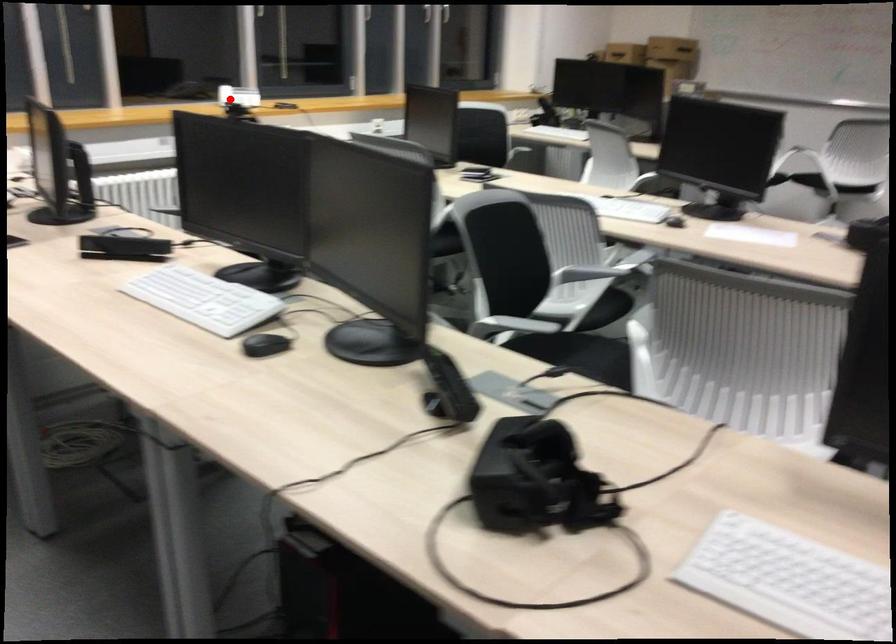
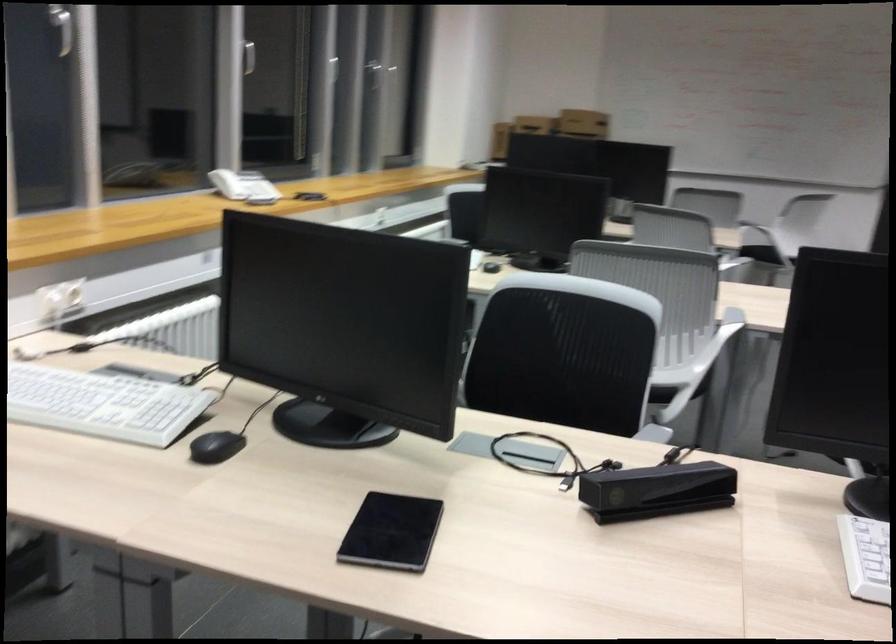
Locate, in the second image, the point that corresponds to the highlighted location in the first image.

(227, 184)